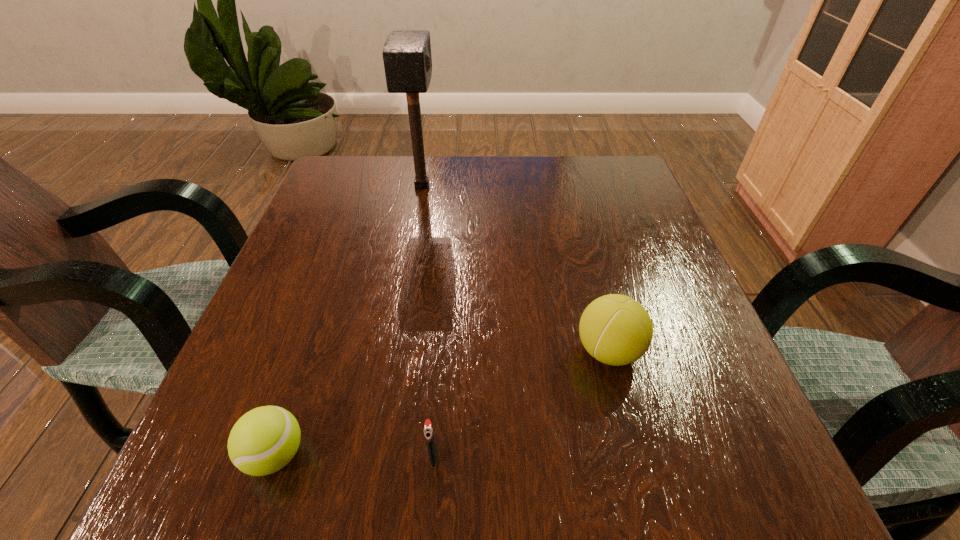
This screenshot has height=540, width=960. What are the coordinates of `free spot located on the back of the third object from left to right` in the screenshot? It's located at (447, 272).

I want to click on object at the far edge, so (407, 59).

Find the location of a particular element. tennis ball at the near edge is located at coordinates (264, 440).

Where is `igniter that is at the near edge`? igniter that is at the near edge is located at coordinates (428, 430).

You are a GUI agent. You are given a task and a screenshot of the screen. Output one action in this format:
    pyautogui.click(x=<x>, y=<y>)
    Task: Click on the object at the left edge
    
    Given the screenshot: What is the action you would take?
    pyautogui.click(x=264, y=440)

This screenshot has width=960, height=540. Identify the location of object that is at the right edge. (617, 330).

This screenshot has width=960, height=540. Find the location of `object located in the near left corner section of the desktop`. object located in the near left corner section of the desktop is located at coordinates (264, 440).

Where is `free space at the far edge of the desktop`? The image size is (960, 540). free space at the far edge of the desktop is located at coordinates (564, 182).

In the image, there is a desktop. Where is `vacant space at the near edge`? vacant space at the near edge is located at coordinates point(527,457).

This screenshot has height=540, width=960. Identify the location of vacant space at the left edge. (315, 315).